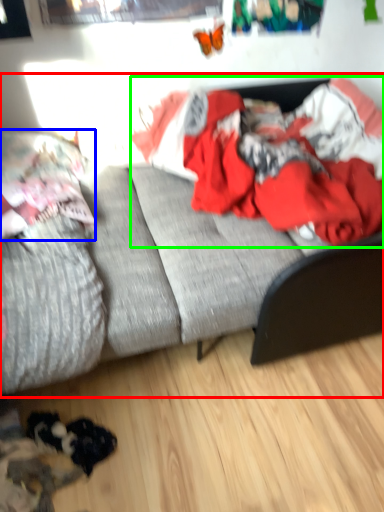
Question: Based on their relative distances, which object is nearer to studio couch (highlighted by a red box)? Choose from pillow (highlighted by a blue box) and clothing (highlighted by a green box).

Choices:
 (A) pillow
 (B) clothing

Answer: (B)